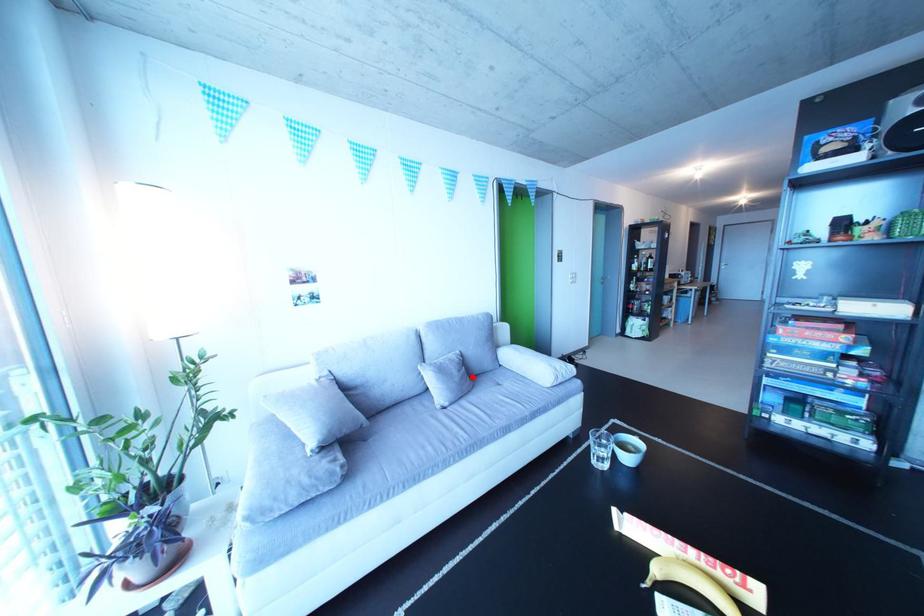
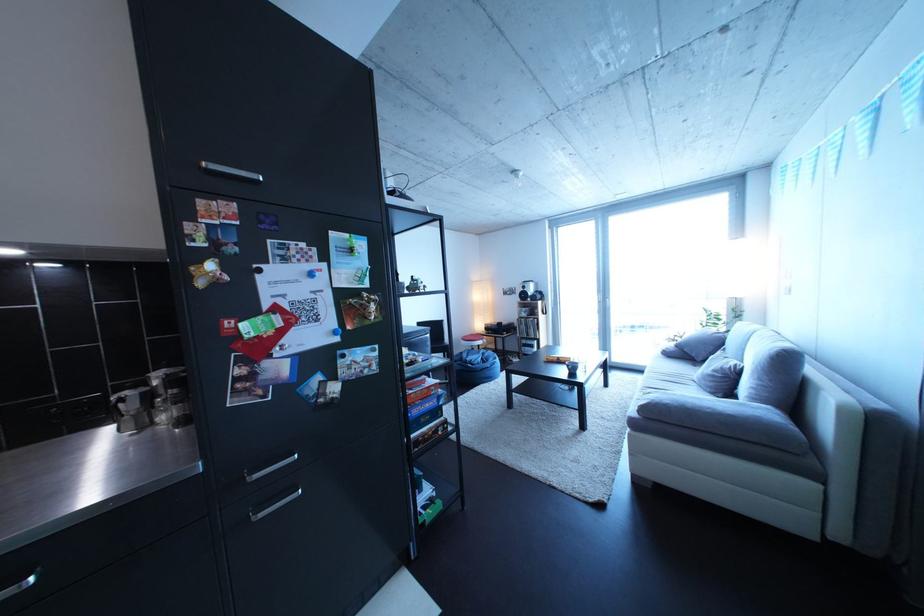
Find the pixel in the second image that matches the highlighted location in the first image.

(727, 377)